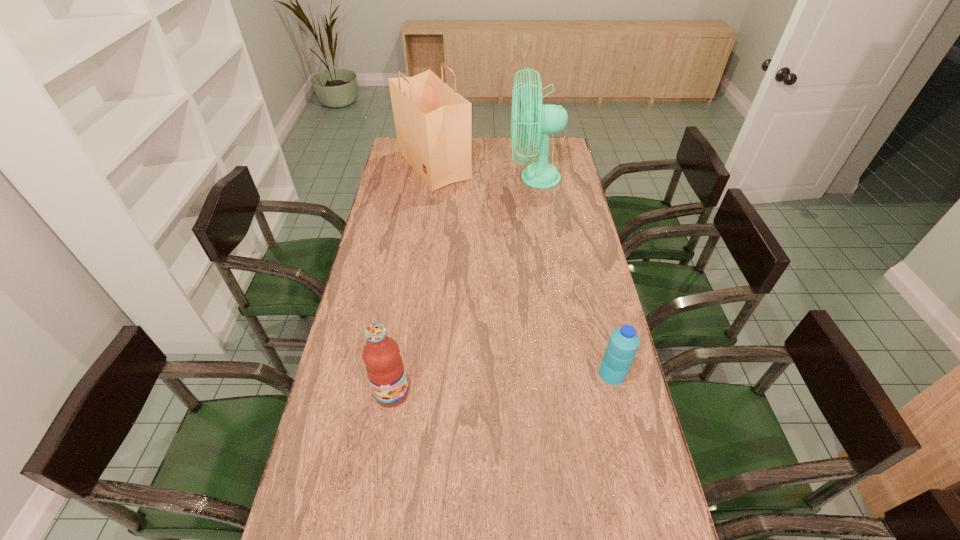
The image size is (960, 540). In order to click on fan that is at the far edge in this screenshot , I will do `click(541, 119)`.

Identify the location of grocery bag present at the far edge. The image size is (960, 540). (433, 122).

At what (x,y) coordinates should I click in order to perform the action: click on grocery bag at the left edge. Please return your answer as a coordinate pair (x, y). The image size is (960, 540). Looking at the image, I should click on (433, 122).

Identify the location of fruit juice at the left edge. tap(384, 366).

Identify the location of fan located at the right edge. click(x=541, y=119).

Locate an element on the screen. This screenshot has width=960, height=540. water bottle present at the right edge is located at coordinates (623, 343).

This screenshot has width=960, height=540. I want to click on object situated at the far left corner, so tap(433, 122).

You are a GUI agent. You are given a task and a screenshot of the screen. Output one action in this format:
    pyautogui.click(x=<x>, y=<y>)
    Task: Click on the object positioned at the far right corner
    The height and width of the screenshot is (540, 960).
    Given the screenshot: What is the action you would take?
    pyautogui.click(x=541, y=119)

Find the location of a particular element. vacant space at the far edge is located at coordinates (528, 137).

Where is `vacant area at the left edge of the desktop`? This screenshot has height=540, width=960. vacant area at the left edge of the desktop is located at coordinates (365, 276).